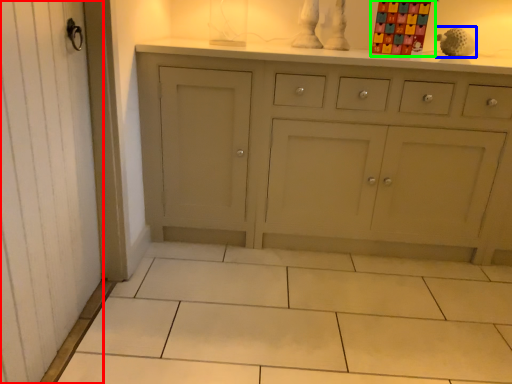
Question: Based on their relative distances, which object is farther from screen door (highlighted by a red box)? Choose from toy (highlighted by a blue box) and toy (highlighted by a green box).

Choices:
 (A) toy
 (B) toy

Answer: (A)